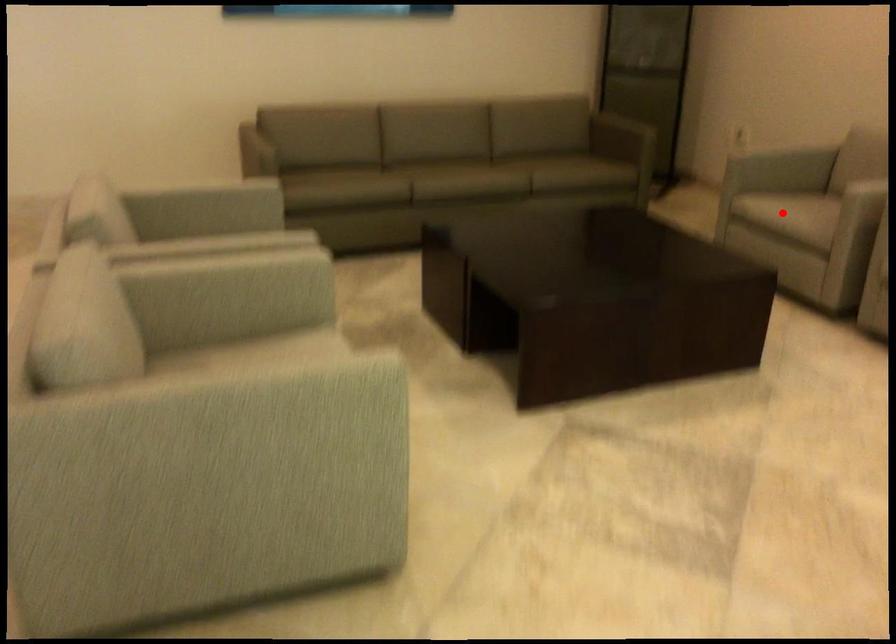
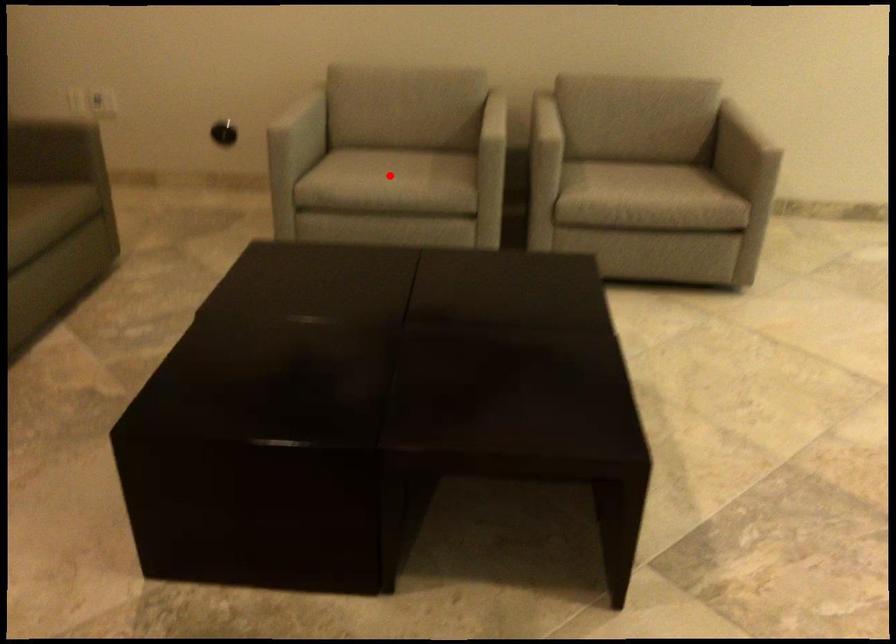
I am providing you with two images of the same scene from different viewpoints. A red point is marked on the first image and another point is marked on the second image. Are the points marked in image1 and image2 representing the same 3D position?

Yes